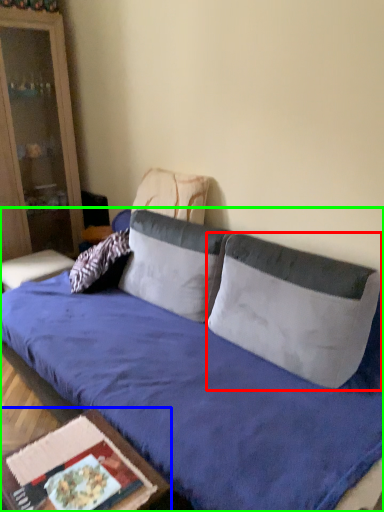
Question: Which is nearer to the pillow (highlighted by a red box)? table (highlighted by a blue box) or studio couch (highlighted by a green box).

Choices:
 (A) table
 (B) studio couch

Answer: (B)